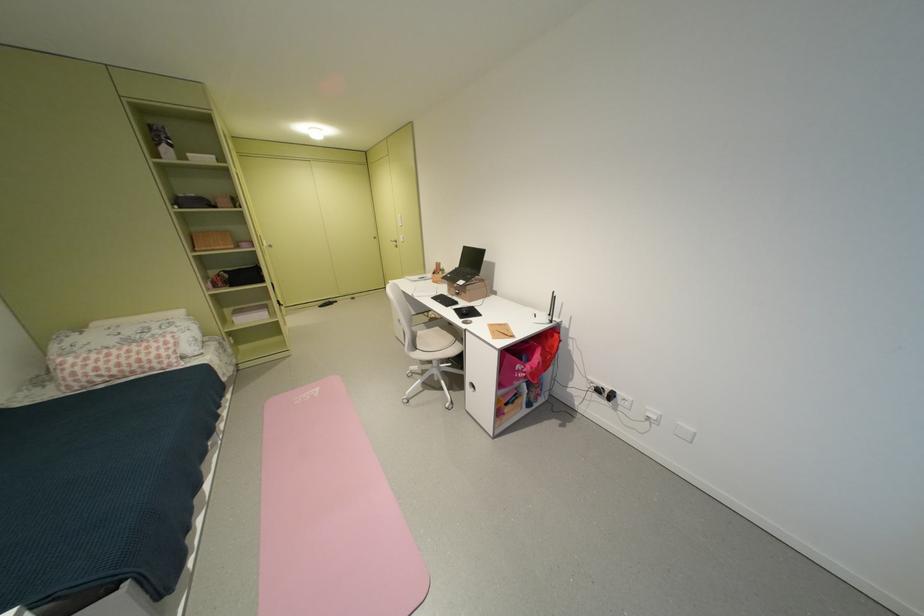
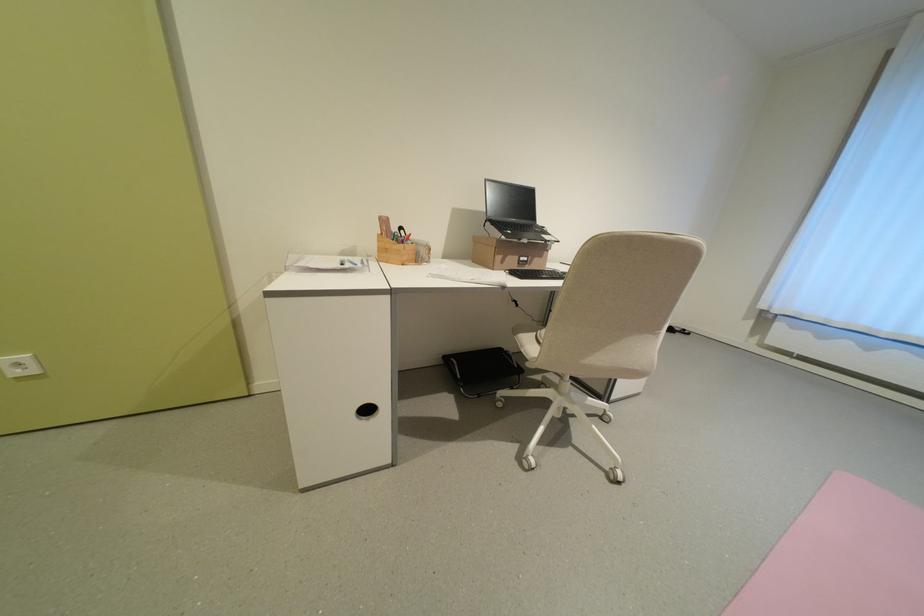
Find the pixel in the second image that matches (458,277) in the first image.

(518, 233)